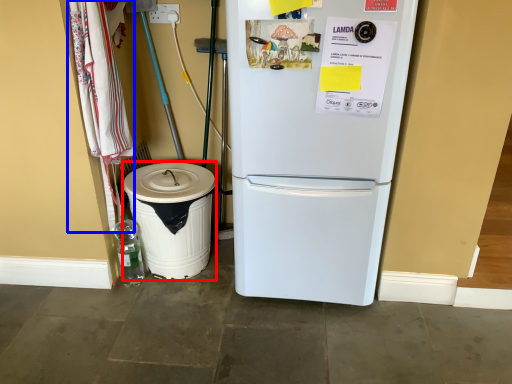
Question: Which point is closer to the camera, trash bin/can (highlighted by a red box) or laundry (highlighted by a blue box)?

Choices:
 (A) trash bin/can
 (B) laundry

Answer: (B)